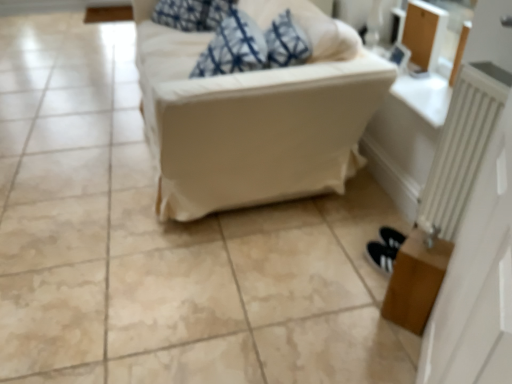
Find the location of a particular element. Image resolution: width=512 pixels, height=384 pixels. vacant space in between white fabric couch at center and white metallic radiator at right is located at coordinates (305, 237).